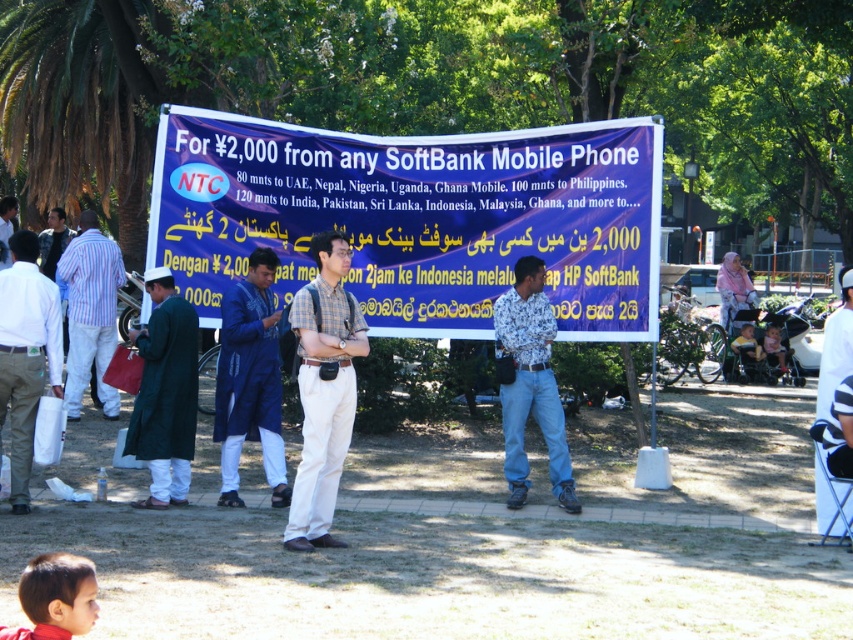
You are a photographer trying to capture a clear photo of the banner. You notice the floral shirt at center and dark green coat at left are blocking the view. Which clothing item is closer to the camera, making it the main obstruction?

The floral shirt at center is in front of the dark green coat at left, so it is closer to the camera and the main obstruction.

You are organizing a charity event and need to arrange seating for two volunteers wearing the floral shirt at center and dark green coat at left. The chairs available are 1.2 meters wide. Will both volunteers fit comfortably if they sit side by side?

The floral shirt at center has a larger width than the dark green coat at left. Since the total width of both volunteers would exceed 1.2 meters, they may not fit comfortably side by side.